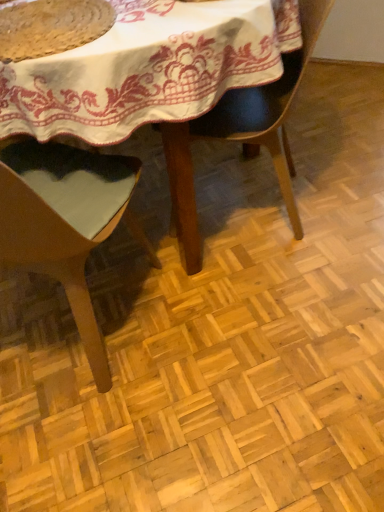
Locate an element on the screen. wooden table at center is located at coordinates (149, 69).

At what (x,y) coordinates should I click in order to perform the action: click on light brown wood chair at center, arranged as the second chair when viewed from the right. Please return your answer as a coordinate pair (x, y). The width and height of the screenshot is (384, 512). Looking at the image, I should click on (66, 222).

In order to face light brown wood chair at center, arranged as the second chair when viewed from the right, should I rotate leftwards or rightwards?

Rotate left and turn 19.476 degrees.

This screenshot has height=512, width=384. Find the location of `wooden table at center`. wooden table at center is located at coordinates (149, 69).

Does wooden table at center have a larger size compared to light brown wood chair at center, arranged as the second chair when viewed from the right?

Correct, wooden table at center is larger in size than light brown wood chair at center, arranged as the second chair when viewed from the right.

Looking at this image, is wooden table at center shorter than light brown wood chair at center, which ranks as the 1th chair in left-to-right order?

Indeed, wooden table at center has a lesser height compared to light brown wood chair at center, which ranks as the 1th chair in left-to-right order.

Which is more to the left, wooden table at center or light brown wood chair at center, which ranks as the 1th chair in left-to-right order?

light brown wood chair at center, which ranks as the 1th chair in left-to-right order, is more to the left.

Looking at this image, how different are the orientations of light brown wood chair at center, which ranks as the 1th chair in left-to-right order, and rustic woven mat at upper left in degrees?

light brown wood chair at center, which ranks as the 1th chair in left-to-right order, and rustic woven mat at upper left are facing 175 degrees away from each other.

From the image's perspective, does light brown wood chair at center, arranged as the second chair when viewed from the right, appear lower than rustic woven mat at upper left?

Yes, from the image's perspective, light brown wood chair at center, arranged as the second chair when viewed from the right, is beneath rustic woven mat at upper left.

Is light brown wood chair at center, arranged as the second chair when viewed from the right, smaller than rustic woven mat at upper left?

Actually, light brown wood chair at center, arranged as the second chair when viewed from the right, might be larger than rustic woven mat at upper left.

Considering the relative sizes of light brown wood chair at center, arranged as the second chair when viewed from the right, and rustic woven mat at upper left in the image provided, is light brown wood chair at center, arranged as the second chair when viewed from the right, wider than rustic woven mat at upper left?

Yes, light brown wood chair at center, arranged as the second chair when viewed from the right, is wider than rustic woven mat at upper left.

The height and width of the screenshot is (512, 384). I want to click on table beneath the rustic woven mat at upper left (from a real-world perspective), so click(149, 69).

Looking at this image, who is taller, rustic woven mat at upper left or wooden table at center?

wooden table at center.

From the image's perspective, which is below, rustic woven mat at upper left or wooden table at center?

rustic woven mat at upper left is shown below in the image.

Can you confirm if rustic woven mat at upper left is positioned to the left of wooden table at center?

Yes.

Is light brown wood chair at center, arranged as the second chair when viewed from the right, wider or thinner than wooden table at center?

Clearly, light brown wood chair at center, arranged as the second chair when viewed from the right, has less width compared to wooden table at center.

Looking at this image, is light brown wood chair at center, which ranks as the 1th chair in left-to-right order, taller than wooden table at center?

Yes.

Could you tell me if light brown wood chair at center, arranged as the second chair when viewed from the right, is turned towards wooden table at center?

Yes, light brown wood chair at center, arranged as the second chair when viewed from the right, is turned towards wooden table at center.

Can you confirm if matte black chair at center, the 2th chair in the left-to-right sequence, is positioned to the left of light brown wood chair at center, which ranks as the 1th chair in left-to-right order?

In fact, matte black chair at center, the 2th chair in the left-to-right sequence, is to the right of light brown wood chair at center, which ranks as the 1th chair in left-to-right order.

From the image's perspective, which is above, matte black chair at center, placed as the first chair when sorted from right to left, or light brown wood chair at center, which ranks as the 1th chair in left-to-right order?

From the image's view, matte black chair at center, placed as the first chair when sorted from right to left, is above.

What's the angular difference between matte black chair at center, the 2th chair in the left-to-right sequence, and light brown wood chair at center, arranged as the second chair when viewed from the right,'s facing directions?

They differ by 102 degrees in their facing directions.

Does matte black chair at center, the 2th chair in the left-to-right sequence, have a larger size compared to light brown wood chair at center, arranged as the second chair when viewed from the right?

No, matte black chair at center, the 2th chair in the left-to-right sequence, is not bigger than light brown wood chair at center, arranged as the second chair when viewed from the right.

Is wooden table at center aimed at rustic woven mat at upper left?

No, wooden table at center does not turn towards rustic woven mat at upper left.

Is point (145, 18) closer to camera compared to point (2, 42)?

No.

From a real-world perspective, is wooden table at center positioned above or below rustic woven mat at upper left?

Clearly, from a real-world perspective, wooden table at center is below rustic woven mat at upper left.

Which is more to the right, wooden table at center or matte black chair at center, placed as the first chair when sorted from right to left?

From the viewer's perspective, matte black chair at center, placed as the first chair when sorted from right to left, appears more on the right side.

Would you say wooden table at center is outside matte black chair at center, placed as the first chair when sorted from right to left?

Yes, wooden table at center is located beyond the bounds of matte black chair at center, placed as the first chair when sorted from right to left.

Can you confirm if wooden table at center is shorter than matte black chair at center, placed as the first chair when sorted from right to left?

No.

In the image, there is a light brown wood chair at center, which ranks as the 1th chair in left-to-right order. Where is `table below it (from a real-world perspective)`? The image size is (384, 512). table below it (from a real-world perspective) is located at coordinates (149, 69).

Image resolution: width=384 pixels, height=512 pixels. I want to click on food behind the light brown wood chair at center, which ranks as the 1th chair in left-to-right order, so click(x=51, y=27).

Looking at the image, which one is located closer to light brown wood chair at center, arranged as the second chair when viewed from the right, rustic woven mat at upper left or matte black chair at center, placed as the first chair when sorted from right to left?

A: rustic woven mat at upper left is positioned closer to the anchor light brown wood chair at center, arranged as the second chair when viewed from the right.

Based on their spatial positions, is rustic woven mat at upper left or matte black chair at center, placed as the first chair when sorted from right to left, closer to wooden table at center?

matte black chair at center, placed as the first chair when sorted from right to left.

Based on their spatial positions, is light brown wood chair at center, arranged as the second chair when viewed from the right, or wooden table at center further from rustic woven mat at upper left?

light brown wood chair at center, arranged as the second chair when viewed from the right.

Which object lies nearer to the anchor point light brown wood chair at center, arranged as the second chair when viewed from the right, matte black chair at center, the 2th chair in the left-to-right sequence, or rustic woven mat at upper left?

The object closer to light brown wood chair at center, arranged as the second chair when viewed from the right, is rustic woven mat at upper left.

When comparing their distances from matte black chair at center, the 2th chair in the left-to-right sequence, does wooden table at center or light brown wood chair at center, which ranks as the 1th chair in left-to-right order, seem closer?

wooden table at center is closer to matte black chair at center, the 2th chair in the left-to-right sequence.

Which object lies further to the anchor point matte black chair at center, placed as the first chair when sorted from right to left, wooden table at center or rustic woven mat at upper left?

The object further to matte black chair at center, placed as the first chair when sorted from right to left, is rustic woven mat at upper left.

Looking at this image, estimate the real-world distances between objects in this image. Which object is closer to light brown wood chair at center, which ranks as the 1th chair in left-to-right order, matte black chair at center, the 2th chair in the left-to-right sequence, or wooden table at center?

The object closer to light brown wood chair at center, which ranks as the 1th chair in left-to-right order, is wooden table at center.

Which object lies further to the anchor point wooden table at center, light brown wood chair at center, arranged as the second chair when viewed from the right, or rustic woven mat at upper left?

light brown wood chair at center, arranged as the second chair when viewed from the right.

Where is `table between rustic woven mat at upper left and matte black chair at center, placed as the first chair when sorted from right to left`? The width and height of the screenshot is (384, 512). table between rustic woven mat at upper left and matte black chair at center, placed as the first chair when sorted from right to left is located at coordinates (149, 69).

Where is `table situated between light brown wood chair at center, which ranks as the 1th chair in left-to-right order, and matte black chair at center, placed as the first chair when sorted from right to left, from left to right`? This screenshot has width=384, height=512. table situated between light brown wood chair at center, which ranks as the 1th chair in left-to-right order, and matte black chair at center, placed as the first chair when sorted from right to left, from left to right is located at coordinates (149, 69).

Find the location of a particular element. Image resolution: width=384 pixels, height=512 pixels. food between wooden table at center and light brown wood chair at center, which ranks as the 1th chair in left-to-right order, from top to bottom is located at coordinates (51, 27).

Where is `food situated between light brown wood chair at center, which ranks as the 1th chair in left-to-right order, and matte black chair at center, placed as the first chair when sorted from right to left, from left to right`? The width and height of the screenshot is (384, 512). food situated between light brown wood chair at center, which ranks as the 1th chair in left-to-right order, and matte black chair at center, placed as the first chair when sorted from right to left, from left to right is located at coordinates (51, 27).